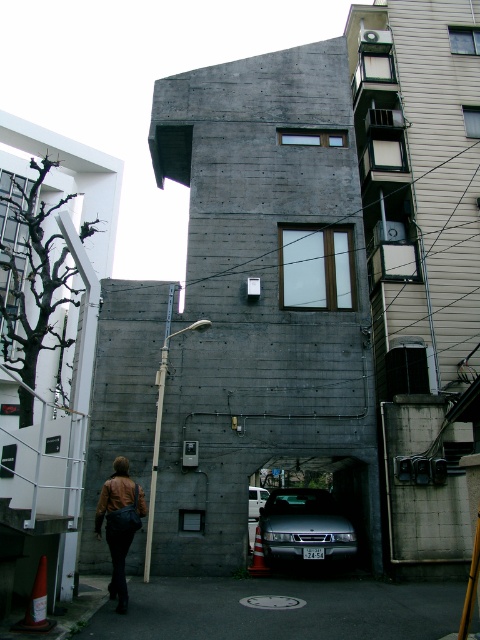
Question: Which of the following is the closest to the observer?

Choices:
 (A) metallic silver car at center
 (B) brown leather jacket at lower left
 (C) dark concrete alley at lower center

Answer: (C)

Question: Which point is closer to the camera?

Choices:
 (A) (250, 484)
 (B) (412, 588)
 (C) (123, 490)
 (D) (296, 516)

Answer: (C)

Question: Does dark concrete alley at lower center have a larger size compared to metallic silver car at center?

Choices:
 (A) no
 (B) yes

Answer: (A)

Question: Can you confirm if dark concrete alley at lower center is positioned above metallic silver car at center?

Choices:
 (A) yes
 (B) no

Answer: (A)

Question: Which is nearer to the metallic silver car at center?

Choices:
 (A) brown leather jacket at lower left
 (B) dark concrete alley at lower center

Answer: (B)

Question: Considering the relative positions of dark concrete alley at lower center and metallic silver car at center in the image provided, where is dark concrete alley at lower center located with respect to metallic silver car at center?

Choices:
 (A) left
 (B) right

Answer: (B)